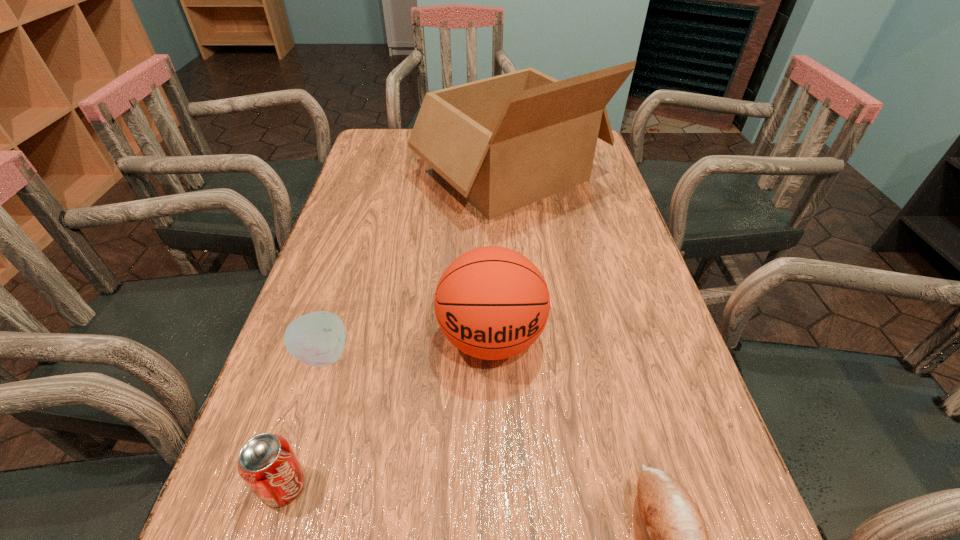
Locate an element on the screen. The width and height of the screenshot is (960, 540). box is located at coordinates (504, 142).

Identify the location of the farthest object. (504, 142).

Where is `the fourth shortest object`? The image size is (960, 540). the fourth shortest object is located at coordinates (492, 303).

Find the location of `soda can`. soda can is located at coordinates (267, 463).

Locate an element on the screen. This screenshot has width=960, height=540. apple is located at coordinates (317, 339).

Locate an element on the screen. vacant area situated on the front of the farthest object is located at coordinates (525, 332).

Locate an element on the screen. free space located 0.220m on the side with logo of the fourth shortest object is located at coordinates (495, 516).

The image size is (960, 540). Find the location of `free spot located on the right of the soda can`. free spot located on the right of the soda can is located at coordinates coord(572,485).

The image size is (960, 540). Identify the location of vacant space located on the right of the apple. pos(422,355).

The height and width of the screenshot is (540, 960). What are the coordinates of `object at the far edge` in the screenshot? It's located at (504, 142).